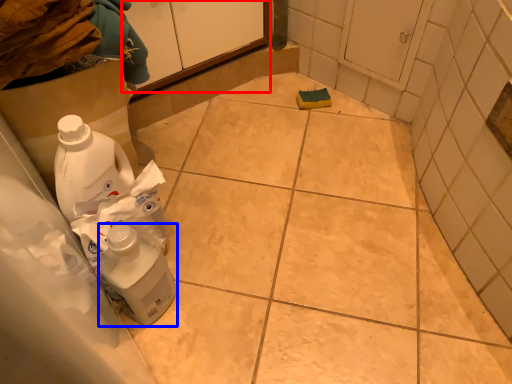
Question: Among these objects, which one is farthest to the camera, cabinetry (highlighted by a red box) or cleaning product (highlighted by a blue box)?

Choices:
 (A) cabinetry
 (B) cleaning product

Answer: (A)